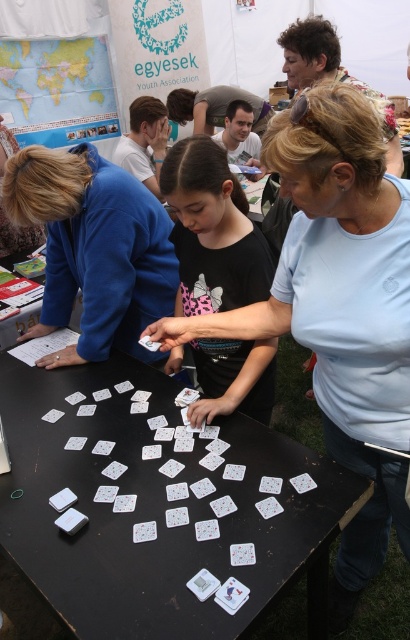
You are standing at the position of point (180, 253) and want to move to the position of point (380, 550). Is the path between these two points clear of any obstacles?

The point (380, 550) is in front of point (180, 253), so the path between them is clear of obstacles.

You are a participant in the card game and need to place a new card on the table. Considering the white paper cards at center and the black matte shirt at center, which object has a larger width and should you consider for spacing?

The white paper cards at center have a larger width than the black matte shirt at center, so you should consider their size when spacing to ensure there is enough room on the table.